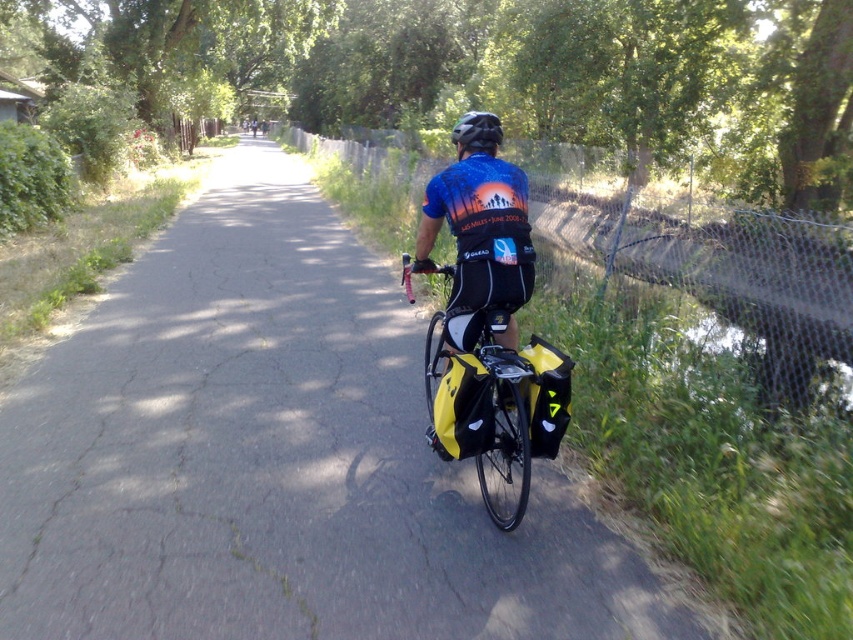
You are a delivery person who needs to choose between the two yellow bags on your bike to pack a large package. The yellow fabric bag at center and the yellow matte bag at center are both available. Which bag should you use based on their sizes?

The yellow fabric bag at center has a larger size compared to the yellow matte bag at center, so you should choose the yellow fabric bag at center to pack the large package.

You are a cyclist riding along a road with a yellow fabric bag at center and a matte black helmet at center. Which object is closer to you as you look forward while riding?

The yellow fabric bag at center is closer to you because it is positioned in front of the matte black helmet at center.

You are a cyclist who wants to check if your yellow matte bag at center is positioned safely below your matte black helmet at center. Based on the scene description, can you confirm the placement?

The yellow matte bag at center is below matte black helmet at center, so it is positioned safely below the helmet.